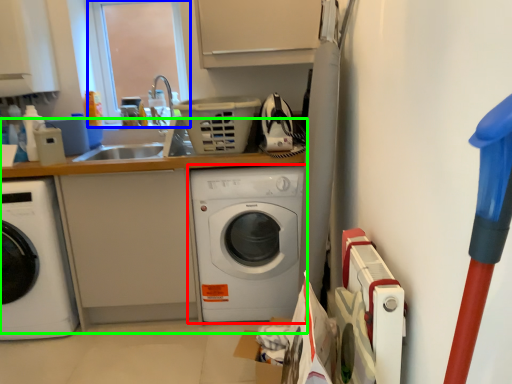
Question: Based on their relative distances, which object is nearer to washing machine (highlighted by a red box)? Choose from window screen (highlighted by a blue box) and counter top (highlighted by a green box).

Choices:
 (A) window screen
 (B) counter top

Answer: (B)